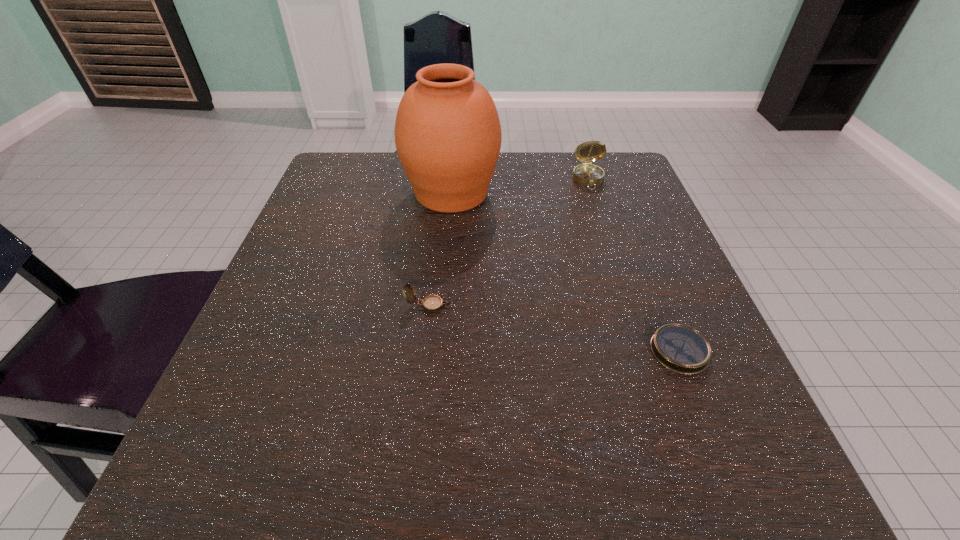
At what (x,y) coordinates should I click in order to perform the action: click on blank space located on the back of the nearest object. Please return your answer as a coordinate pair (x, y). Looking at the image, I should click on (632, 232).

Where is `urn that is at the far edge`? urn that is at the far edge is located at coordinates (448, 136).

Find the location of a particular element. The width and height of the screenshot is (960, 540). compass that is at the far edge is located at coordinates (586, 174).

This screenshot has height=540, width=960. Identify the location of object at the far right corner. (586, 174).

In order to click on vacant space at the near edge of the desktop in this screenshot , I will do `click(367, 498)`.

Locate an element on the screen. This screenshot has width=960, height=540. vacant area at the left edge is located at coordinates (309, 244).

Locate an element on the screen. vacant area at the right edge of the desktop is located at coordinates (627, 255).

Find the location of `free space at the far left corner`. free space at the far left corner is located at coordinates (321, 181).

In the image, there is a desktop. What are the coordinates of `free space at the far right corner` in the screenshot? It's located at (633, 164).

At what (x,y) coordinates should I click in order to perform the action: click on vacant space that is in between the leftmost compass and the tallest compass. Please return your answer as a coordinate pair (x, y). Image resolution: width=960 pixels, height=540 pixels. Looking at the image, I should click on (509, 242).